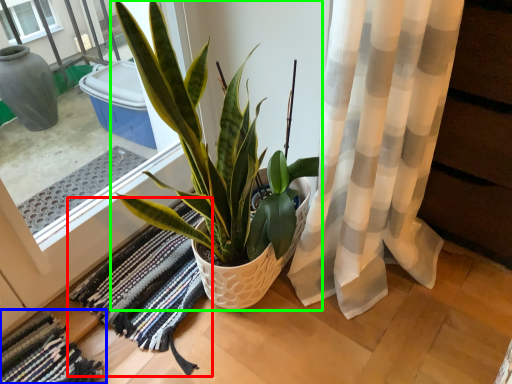
Question: Which object is the closest to the bath mat (highlighted by a red box)? Choose among these: bath mat (highlighted by a blue box) or houseplant (highlighted by a green box).

Choices:
 (A) bath mat
 (B) houseplant

Answer: (A)